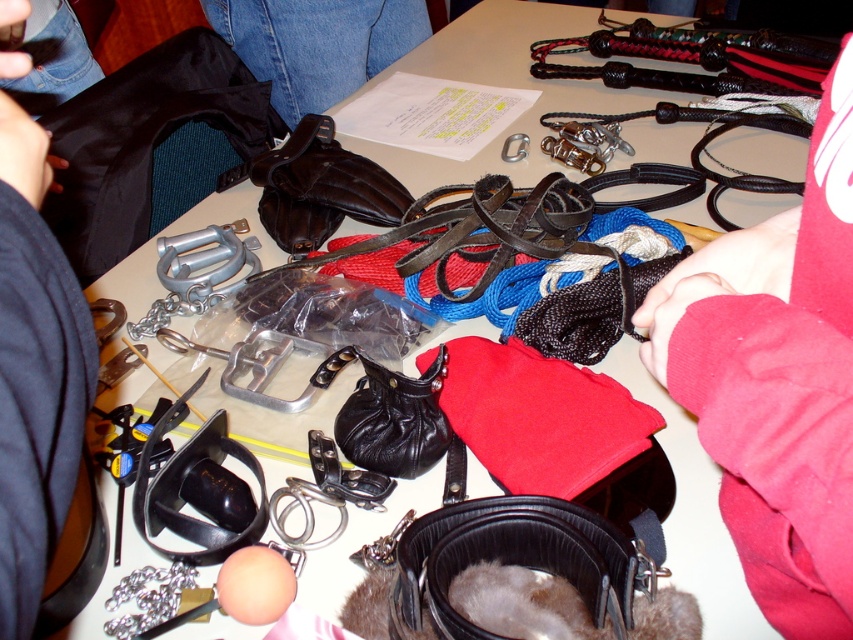
You are organizing a closet and see the red fabric sleeve at upper right and the red leather jacket at lower right. Which item is positioned to the right of the other?

The red fabric sleeve at upper right is to the right of the red leather jacket at lower right.

You are organizing a closet and need to place the red leather jacket at lower right and the black leather purse at center. Given their sizes, which item should you place on the higher shelf to accommodate their height?

The red leather jacket at lower right is much taller than the black leather purse at center, so you should place the red leather jacket at lower right on the higher shelf to accommodate its height.

You are a photographer setting up a shot of the table with all the BDSM items. You need to ensure that the focal point is exactly at the position of point (32, 252). Given that the camera is positioned 15.30 inches away from this point, what adjustment should you make to the camera to focus on this point?

The camera is already positioned 15.30 inches away from point (32, 252), so no adjustment is needed to focus on this point since the focal point is already at the correct distance.